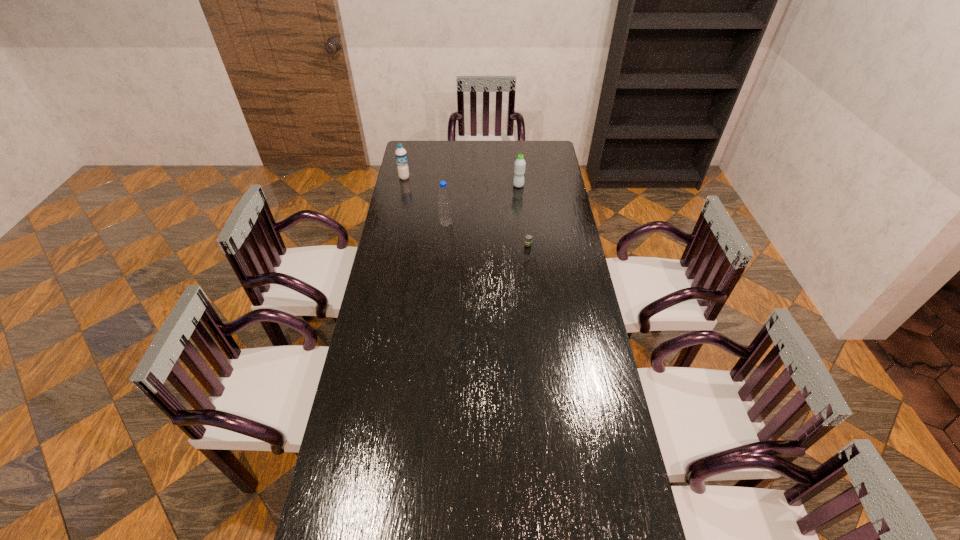
Locate an element on the screen. The height and width of the screenshot is (540, 960). the tallest water bottle is located at coordinates (444, 197).

Find the location of a particular element. the second water bottle from left to right is located at coordinates (444, 197).

At what (x,y) coordinates should I click in order to perform the action: click on the farthest water bottle. Please return your answer as a coordinate pair (x, y). Image resolution: width=960 pixels, height=540 pixels. Looking at the image, I should click on (401, 156).

Identify the location of the leftmost object. Image resolution: width=960 pixels, height=540 pixels. (401, 156).

Image resolution: width=960 pixels, height=540 pixels. I want to click on the second nearest water bottle, so click(519, 167).

Image resolution: width=960 pixels, height=540 pixels. What are the coordinates of `the rightmost water bottle` in the screenshot? It's located at (519, 167).

Locate an element on the screen. The height and width of the screenshot is (540, 960). the shortest object is located at coordinates (528, 239).

Where is `beer can`? The width and height of the screenshot is (960, 540). beer can is located at coordinates (528, 239).

I want to click on free region located on the left of the tallest water bottle, so click(418, 224).

Find the location of `free spot located on the label of the leftmost object`. free spot located on the label of the leftmost object is located at coordinates (395, 223).